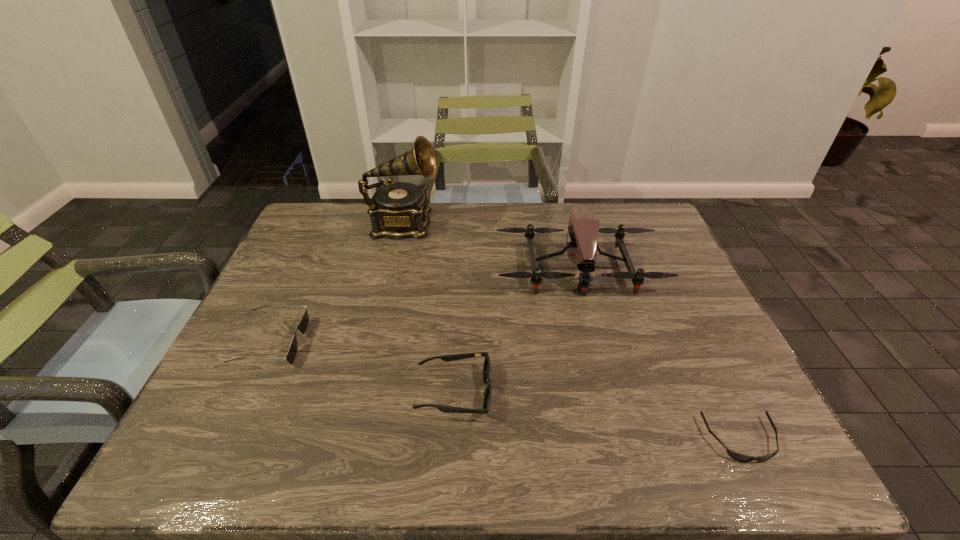
What are the coordinates of `phonograph record` in the screenshot? It's located at (397, 210).

Locate an element on the screen. drone is located at coordinates (583, 227).

Locate an element on the screen. This screenshot has width=960, height=540. the leftmost sunglasses is located at coordinates (303, 325).

This screenshot has height=540, width=960. I want to click on the second sunglasses from left to right, so click(447, 358).

Locate an element on the screen. Image resolution: width=960 pixels, height=540 pixels. the rightmost sunglasses is located at coordinates (739, 457).

Identify the location of the shortest object. This screenshot has height=540, width=960. (739, 457).

Find the location of a particular element. The image size is (960, 540). free point located on the horn of the tallest object is located at coordinates coord(482,225).

Where is `free space located on the front-facing side of the drone`? The width and height of the screenshot is (960, 540). free space located on the front-facing side of the drone is located at coordinates (594, 335).

Find the location of a particular element. The height and width of the screenshot is (540, 960). blank area located on the front-facing side of the leftmost object is located at coordinates (331, 342).

This screenshot has width=960, height=540. I want to click on free location located on the front-facing side of the second sunglasses from right to left, so click(561, 392).